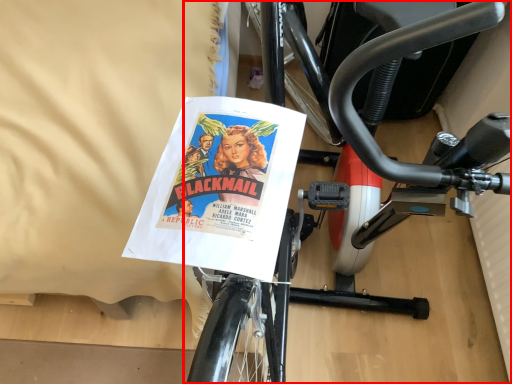
Question: From the image, what is the correct spatial relationship of bicycle (annotated by the red box) in relation to sheet?

Choices:
 (A) right
 (B) left

Answer: (A)